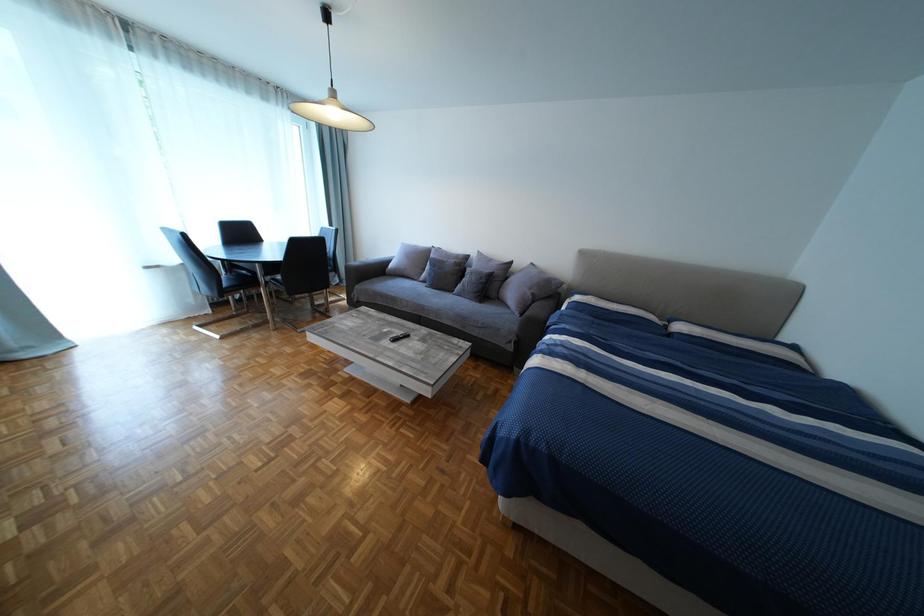
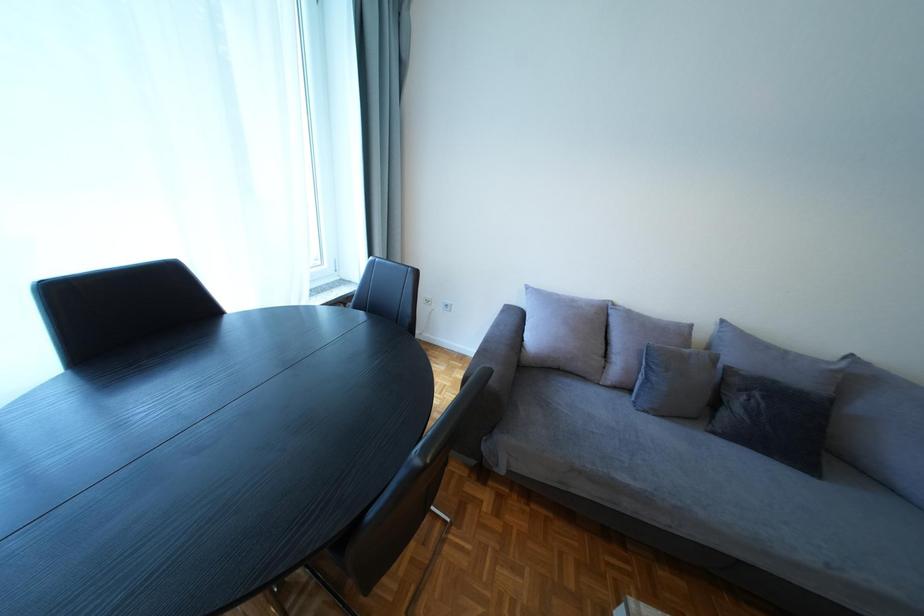
In a continuous first-person perspective shot, in which direction is the camera moving?

The cameraman walked toward left, forward.